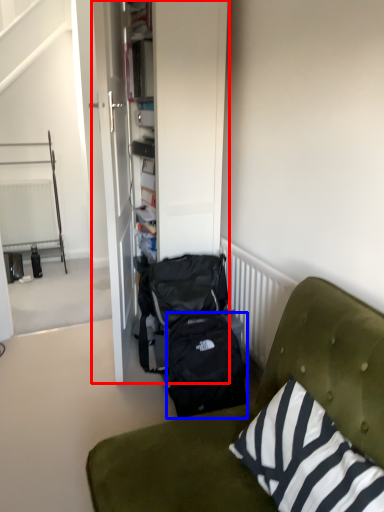
Question: Which object is further to the camera taking this photo, armoire (highlighted by a red box) or backpack (highlighted by a blue box)?

Choices:
 (A) armoire
 (B) backpack

Answer: (A)